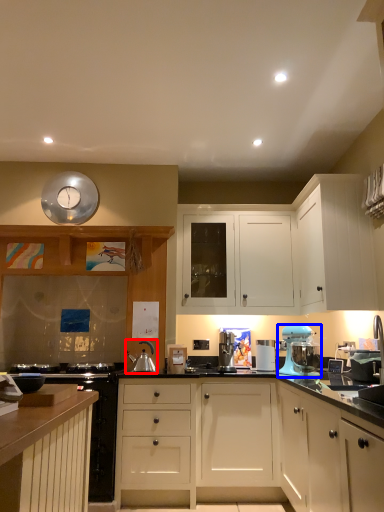
Question: Which of the following is the farthest to the observer, appliance (highlighted by a red box) or home appliance (highlighted by a blue box)?

Choices:
 (A) appliance
 (B) home appliance

Answer: (A)